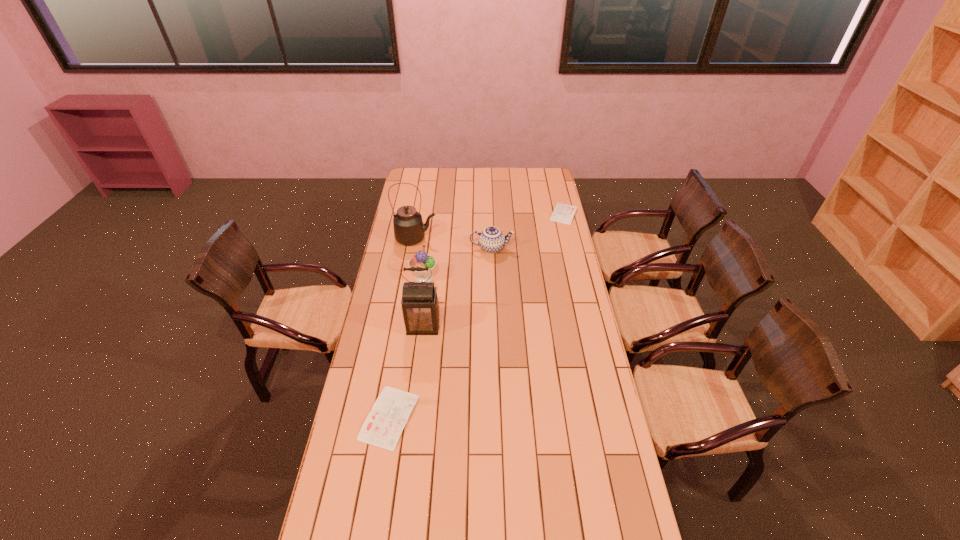
Please point a spot to place another diary for symmetrical spacing. Please provide its 2D coordinates. Your answer should be formatted as a tuple, i.e. [(x, y)], where the tuple contains the x and y coordinates of a point satisfying the conditions above.

[(496, 292)]